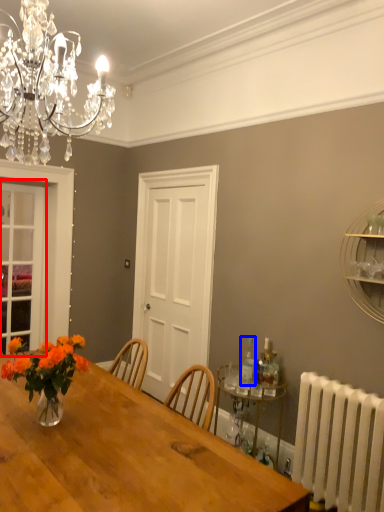
Question: Among these objects, which one is nearest to the camera, glass door (highlighted by a red box) or bottle (highlighted by a blue box)?

Choices:
 (A) glass door
 (B) bottle

Answer: (B)